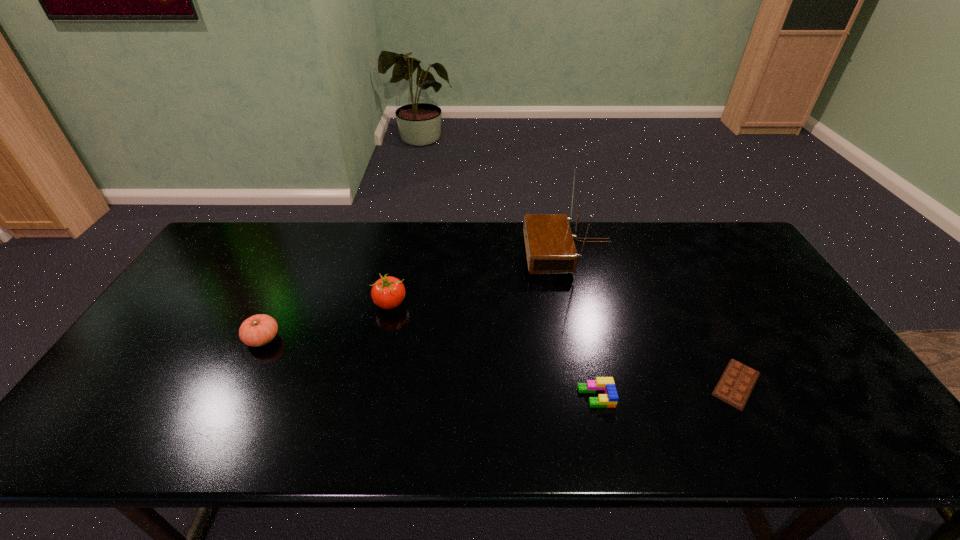
What are the coordinates of `empty location between the shorter tomato and the fourth tallest object` in the screenshot? It's located at (429, 368).

You are a GUI agent. You are given a task and a screenshot of the screen. Output one action in this format:
    pyautogui.click(x=<x>, y=<y>)
    Task: Click on the blank region between the third tallest object and the farthest object
    The height and width of the screenshot is (540, 960).
    Given the screenshot: What is the action you would take?
    pyautogui.click(x=416, y=295)

Identify which object is located as the fourth nearest to the second shortest object. Please provide its 2D coordinates. Your answer should be formatted as a tuple, i.e. [(x, y)], where the tuple contains the x and y coordinates of a point satisfying the conditions above.

[(258, 330)]

Identify the location of object that stands as the third closest to the shortest object. (388, 292).

At what (x,y) coordinates should I click in order to perform the action: click on vacant region that satisfies the following two spatial constraints: 1. on the front side of the farther tomato; 2. on the right side of the rightmost object. Please return your answer as a coordinate pair (x, y). Looking at the image, I should click on (372, 384).